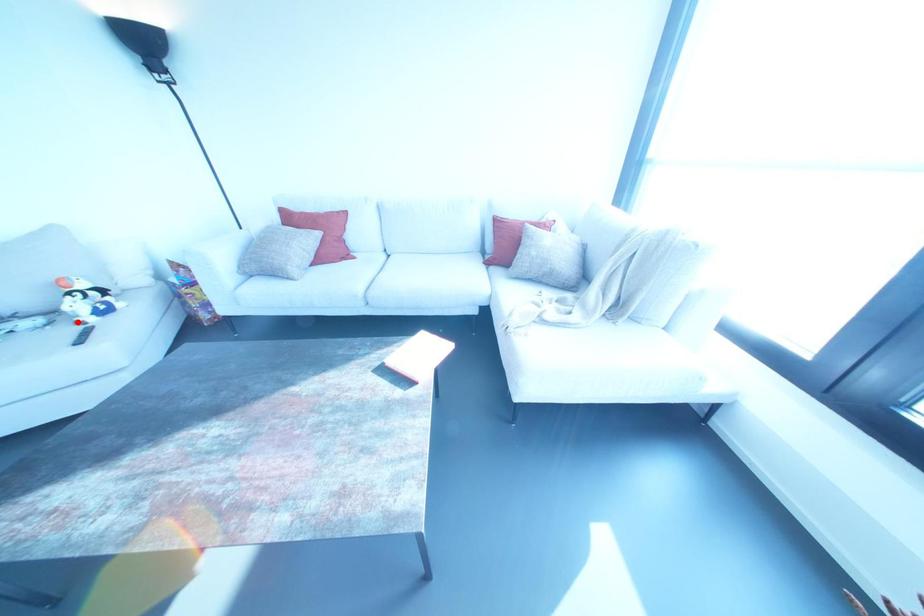
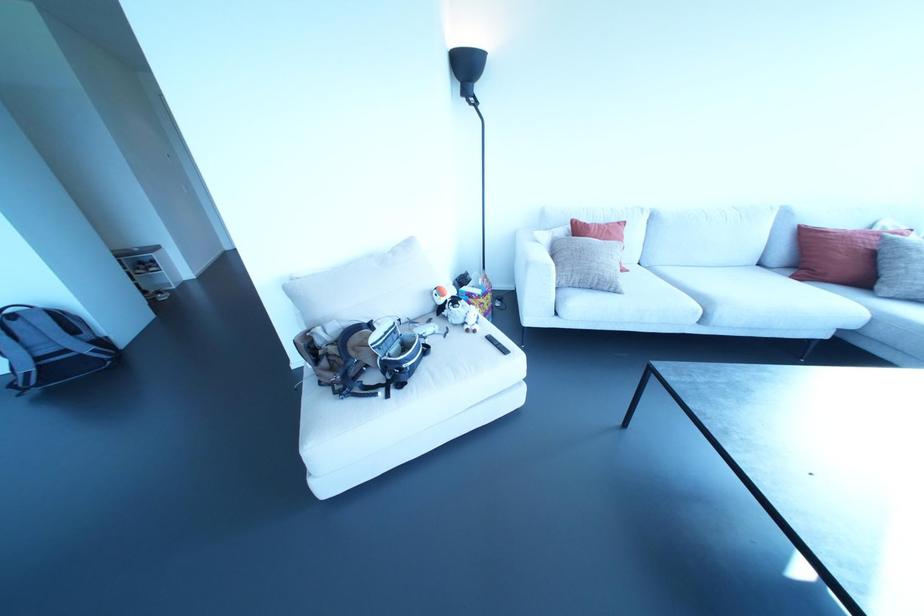
In the second image, find the point that corresponds to the highlighted location in the first image.

(467, 330)